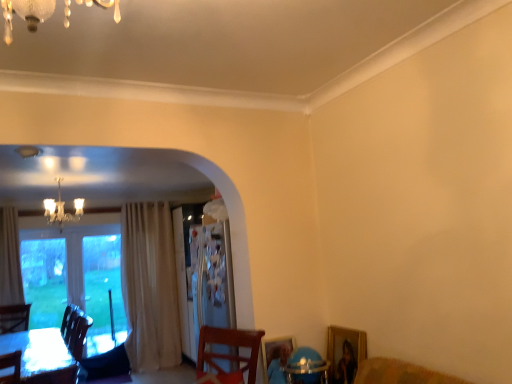
Question: Considering the relative sizes of transparent glass window at left and blue plastic round table at lower right in the image provided, is transparent glass window at left wider than blue plastic round table at lower right?

Choices:
 (A) yes
 (B) no

Answer: (B)

Question: Can you confirm if transparent glass window at left is shorter than blue plastic round table at lower right?

Choices:
 (A) yes
 (B) no

Answer: (B)

Question: Is transparent glass window at left placed right next to blue plastic round table at lower right?

Choices:
 (A) no
 (B) yes

Answer: (A)

Question: Is transparent glass window at left further to the viewer compared to blue plastic round table at lower right?

Choices:
 (A) yes
 (B) no

Answer: (A)

Question: Does transparent glass window at left turn towards blue plastic round table at lower right?

Choices:
 (A) no
 (B) yes

Answer: (B)

Question: Are transparent glass window at left and blue plastic round table at lower right located far from each other?

Choices:
 (A) yes
 (B) no

Answer: (A)

Question: Does gold-framed picture at lower right have a lesser height compared to crystal chandelier at upper left?

Choices:
 (A) no
 (B) yes

Answer: (B)

Question: From the image's perspective, is gold-framed picture at lower right on crystal chandelier at upper left?

Choices:
 (A) no
 (B) yes

Answer: (A)

Question: Is gold-framed picture at lower right taller than crystal chandelier at upper left?

Choices:
 (A) yes
 (B) no

Answer: (B)

Question: Could you tell me if gold-framed picture at lower right is facing crystal chandelier at upper left?

Choices:
 (A) no
 (B) yes

Answer: (A)

Question: From a real-world perspective, is gold-framed picture at lower right beneath crystal chandelier at upper left?

Choices:
 (A) yes
 (B) no

Answer: (A)

Question: Considering the relative positions of gold-framed picture at lower right and crystal chandelier at upper left in the image provided, is gold-framed picture at lower right to the right of crystal chandelier at upper left from the viewer's perspective?

Choices:
 (A) no
 (B) yes

Answer: (B)

Question: Is gold-framed picture at lower right to the left of transparent glass window at left from the viewer's perspective?

Choices:
 (A) no
 (B) yes

Answer: (A)